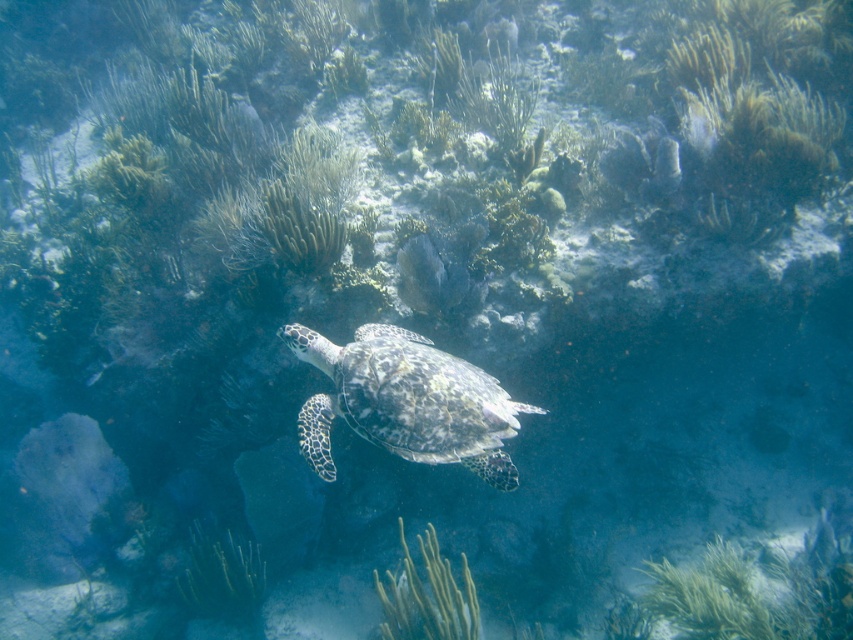
Question: Which point is farther to the camera?

Choices:
 (A) speckled shell turtle at center
 (B) green soft coral at center

Answer: (B)

Question: Which point is farther to the camera?

Choices:
 (A) (495, 387)
 (B) (425, 532)

Answer: (B)

Question: Is speckled shell turtle at center above green soft coral at center?

Choices:
 (A) yes
 (B) no

Answer: (A)

Question: Where is speckled shell turtle at center located in relation to green soft coral at center in the image?

Choices:
 (A) right
 (B) left

Answer: (B)

Question: Is speckled shell turtle at center positioned before green soft coral at center?

Choices:
 (A) no
 (B) yes

Answer: (B)